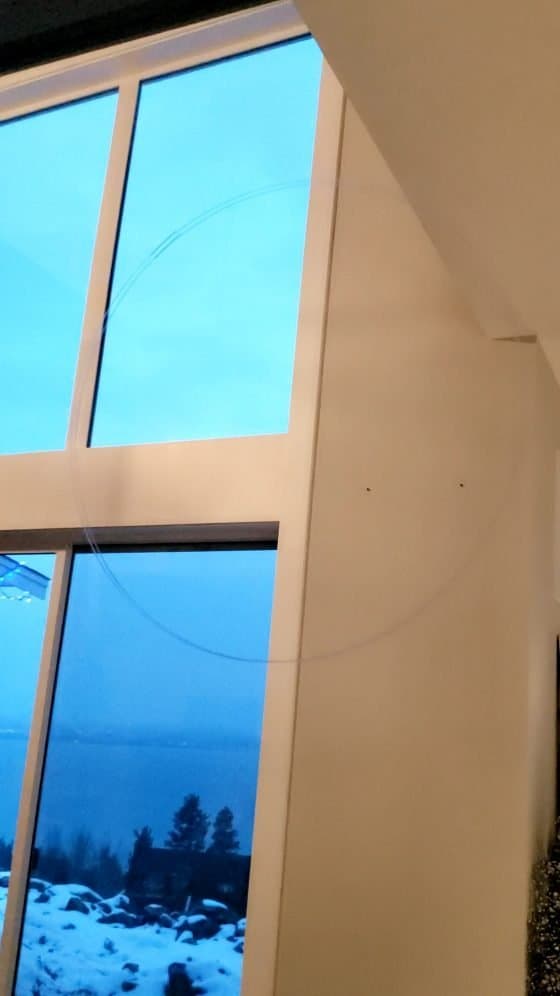
What are the coordinates of `white wall` in the screenshot? It's located at (452, 499).